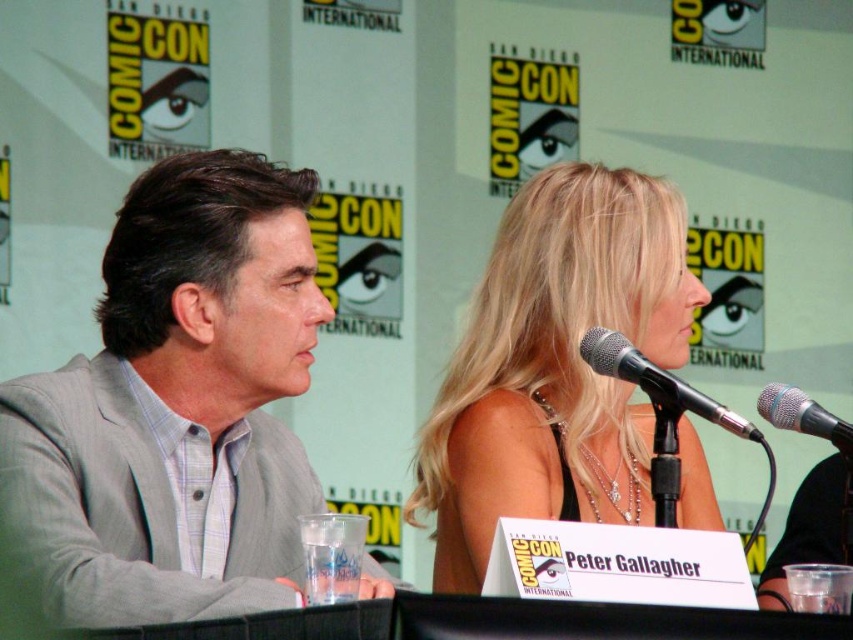
Question: Which object is farther from the camera taking this photo?

Choices:
 (A) blonde hair at center
 (B) silver metallic microphone at right

Answer: (A)

Question: Does black metallic microphone at upper center appear under silver metallic microphone at right?

Choices:
 (A) no
 (B) yes

Answer: (A)

Question: Estimate the real-world distances between objects in this image. Which object is closer to the gray fabric suit at left?

Choices:
 (A) silver metallic microphone at right
 (B) blonde hair at center

Answer: (B)

Question: Can you confirm if gray fabric suit at left is positioned to the right of black metallic microphone at upper center?

Choices:
 (A) no
 (B) yes

Answer: (A)

Question: Does gray fabric suit at left lie in front of black metallic microphone at upper center?

Choices:
 (A) yes
 (B) no

Answer: (A)

Question: Which of the following is the farthest from the observer?

Choices:
 (A) (201, 224)
 (B) (641, 264)

Answer: (B)